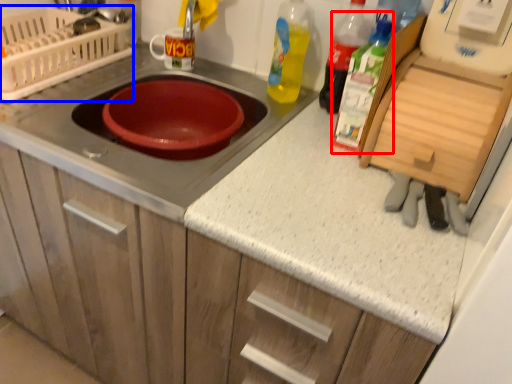
Question: Among these objects, which one is nearest to the camera, bottle (highlighted by a red box) or appliance (highlighted by a blue box)?

Choices:
 (A) bottle
 (B) appliance

Answer: (A)